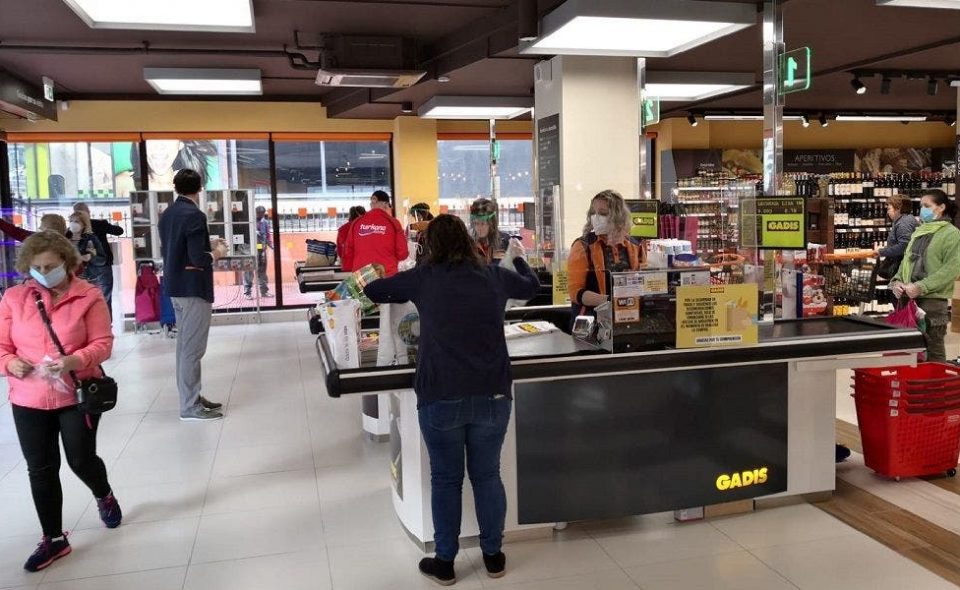
You are a GUI agent. You are given a task and a screenshot of the screen. Output one action in this format:
    pyautogui.click(x=<x>, y=<y>)
    Task: Click on the overhead square light
    This screenshot has width=960, height=590.
    Given the screenshot: What is the action you would take?
    pyautogui.click(x=200, y=91), pyautogui.click(x=150, y=19), pyautogui.click(x=643, y=38), pyautogui.click(x=464, y=107), pyautogui.click(x=688, y=95), pyautogui.click(x=894, y=122), pyautogui.click(x=741, y=118)